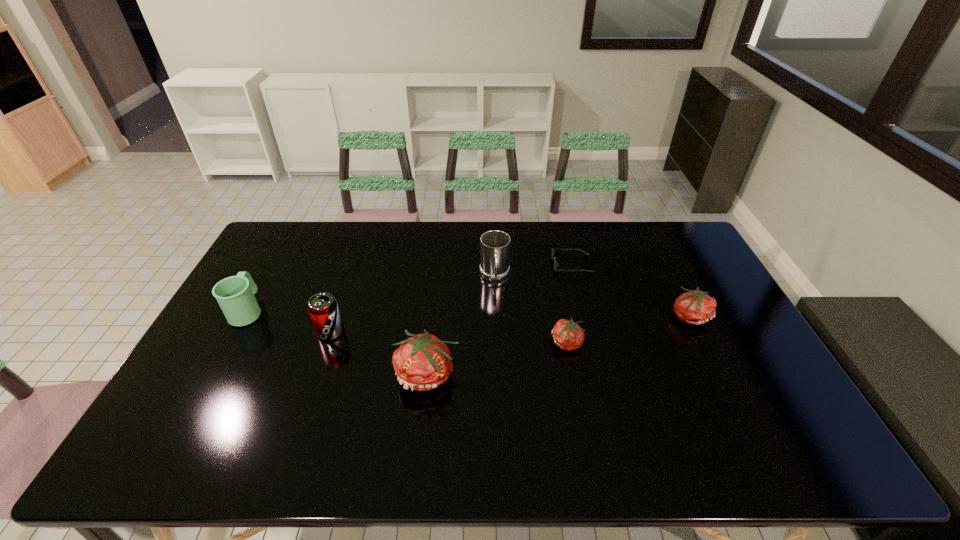
In the image, there is a desktop. Where is `vacant space at the far left corner`? The height and width of the screenshot is (540, 960). vacant space at the far left corner is located at coordinates (283, 230).

Find the location of a particular element. The image size is (960, 540). vacant area at the near left corner is located at coordinates (216, 399).

The image size is (960, 540). In order to click on free point at the far right corner in this screenshot , I will do `click(694, 258)`.

Locate an element on the screen. This screenshot has height=540, width=960. free space between the tallest tomato and the sunglasses is located at coordinates (499, 320).

Image resolution: width=960 pixels, height=540 pixels. I want to click on free spot between the third object from left to right and the fourth object from right to left, so click(x=461, y=326).

Identify the location of unoccupied position between the leftmost object and the second tomato from right to left. This screenshot has width=960, height=540. (407, 327).

You are a GUI agent. You are given a task and a screenshot of the screen. Output one action in this format:
    pyautogui.click(x=<x>, y=<y>)
    Task: Click on the vacant point located between the right mug and the shortest tomato
    The height and width of the screenshot is (540, 960).
    Given the screenshot: What is the action you would take?
    pyautogui.click(x=531, y=310)

This screenshot has height=540, width=960. I want to click on free space between the leftmost object and the sixth object from right to left, so point(289,321).

The height and width of the screenshot is (540, 960). In order to click on free space between the nearer mug and the tallest tomato in this screenshot , I will do `click(338, 343)`.

The height and width of the screenshot is (540, 960). What are the coordinates of `vacant space in between the fourth object from right to left and the rightmost tomato` in the screenshot? It's located at (592, 296).